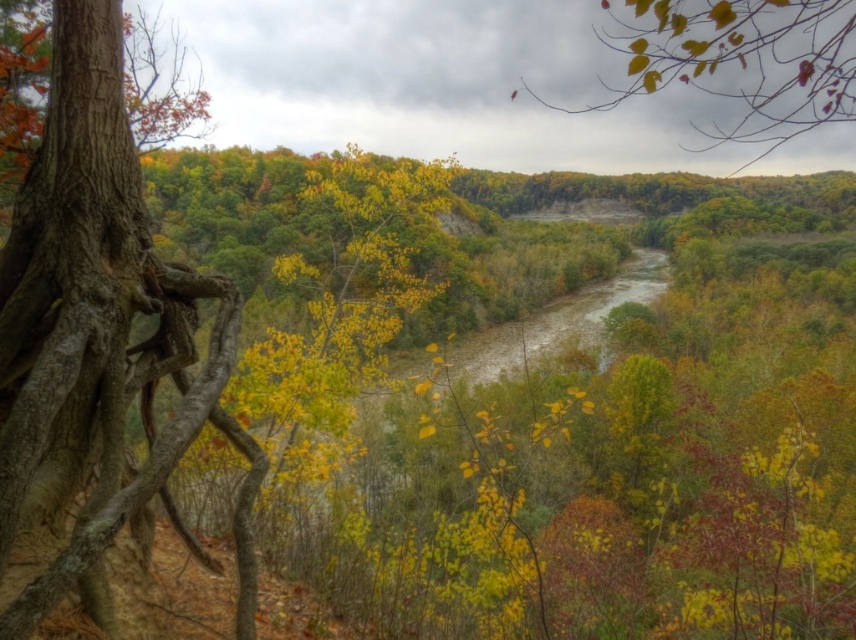
Between smooth brown tree trunk at left and yellow-green leaves at upper center, which one is positioned higher?

Positioned higher is yellow-green leaves at upper center.

Is smooth brown tree trunk at left above yellow-green leaves at upper center?

Incorrect, smooth brown tree trunk at left is not positioned above yellow-green leaves at upper center.

Is point (63, 387) more distant than point (845, 33)?

That is False.

This screenshot has width=856, height=640. What are the coordinates of `smooth brown tree trunk at left` in the screenshot? It's located at (90, 321).